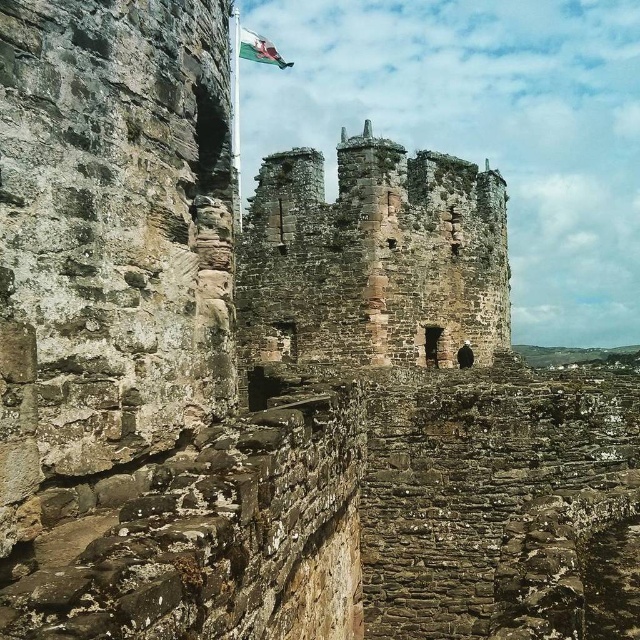
Which is more to the left, rusty stone tower at center or white fabric flag at upper center?

From the viewer's perspective, white fabric flag at upper center appears more on the left side.

Is rusty stone tower at center smaller than white fabric flag at upper center?

No.

Locate an element on the screen. The height and width of the screenshot is (640, 640). rusty stone tower at center is located at coordinates (372, 259).